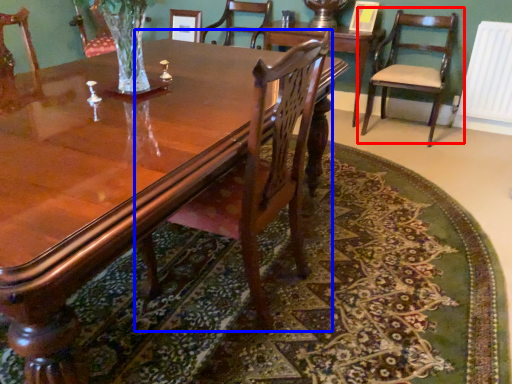
Question: Which object appears closest to the camera in this image, chair (highlighted by a red box) or chair (highlighted by a blue box)?

Choices:
 (A) chair
 (B) chair

Answer: (B)